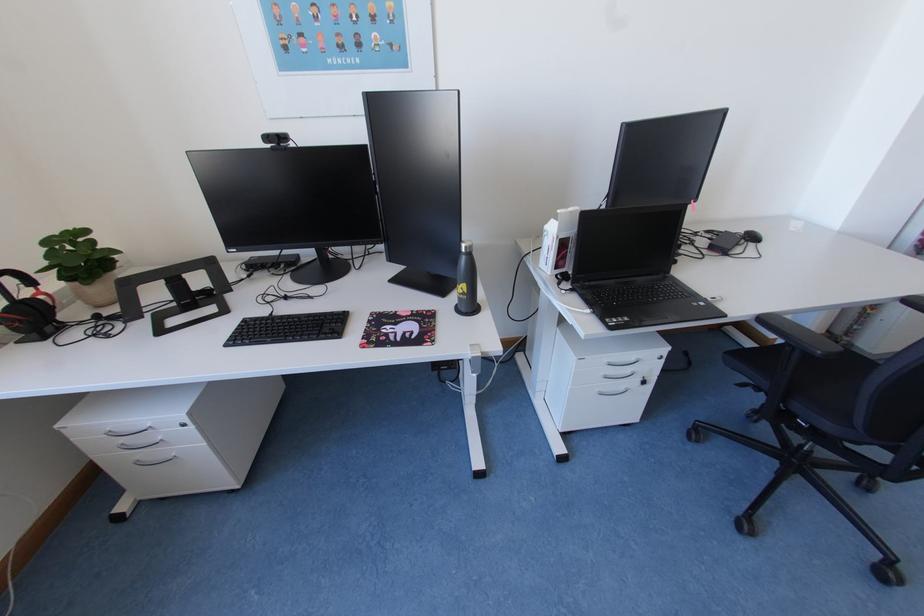
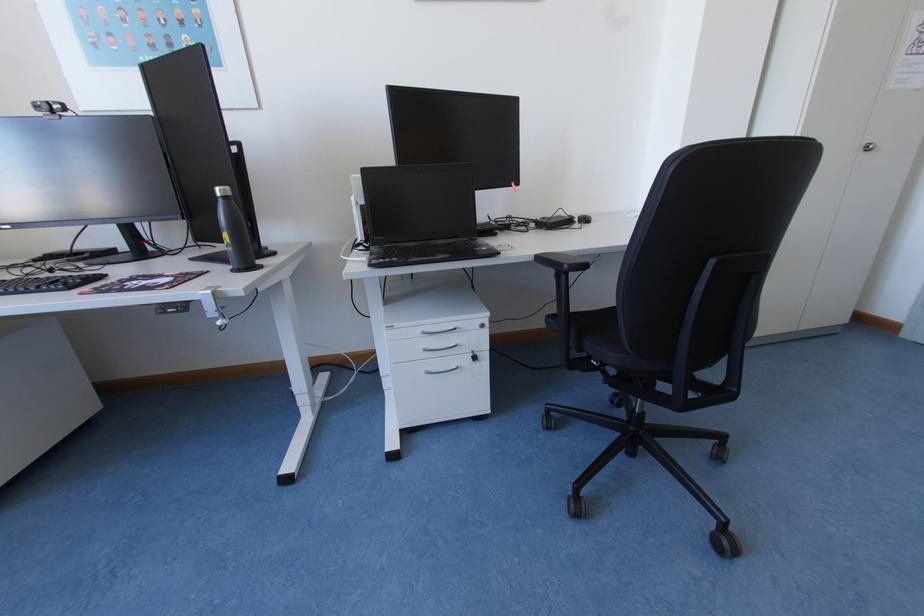
Question: How did the camera likely rotate?

Choices:
 (A) Left
 (B) Right
 (C) Up
 (D) Down

Answer: (C)